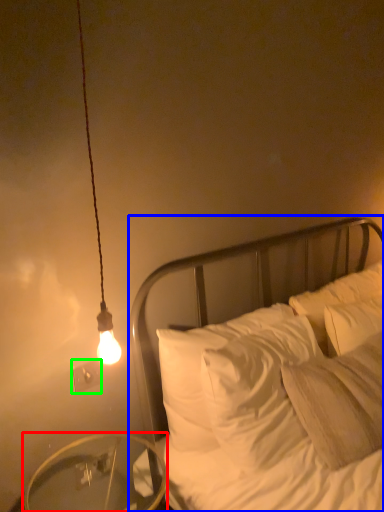
Question: Which is nearer to the table (highlighted by a red box)? bed (highlighted by a blue box) or electric outlet (highlighted by a green box).

Choices:
 (A) bed
 (B) electric outlet

Answer: (B)